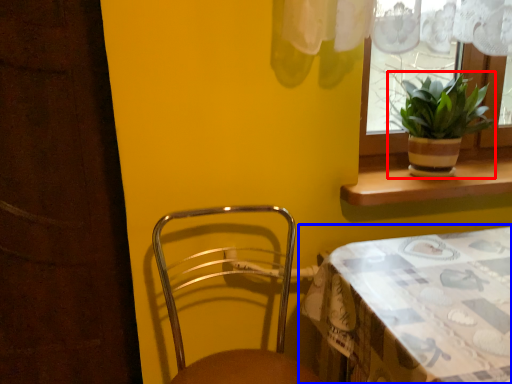
Question: Which object appears farthest to the camera in this image, houseplant (highlighted by a red box) or table (highlighted by a blue box)?

Choices:
 (A) houseplant
 (B) table

Answer: (A)